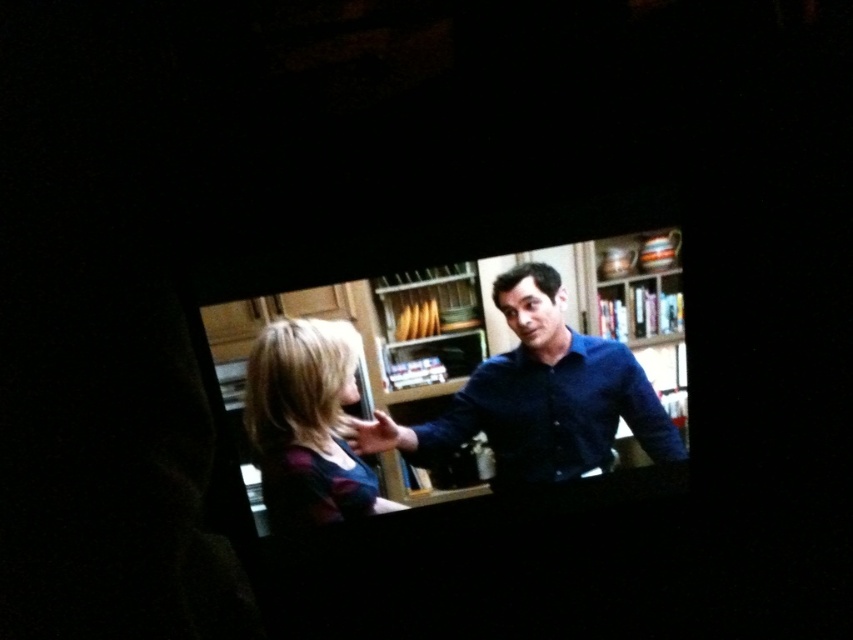
Question: Is the position of dark blue shirt at center less distant than that of matte black shirt at lower left?

Choices:
 (A) yes
 (B) no

Answer: (B)

Question: Which point is farther from the camera taking this photo?

Choices:
 (A) (291, 397)
 (B) (433, 436)

Answer: (B)

Question: Which object is closer to the camera taking this photo?

Choices:
 (A) matte black shirt at lower left
 (B) dark blue shirt at center

Answer: (A)

Question: Does dark blue shirt at center appear under matte black shirt at lower left?

Choices:
 (A) yes
 (B) no

Answer: (B)

Question: Can you confirm if dark blue shirt at center is positioned above matte black shirt at lower left?

Choices:
 (A) yes
 (B) no

Answer: (A)